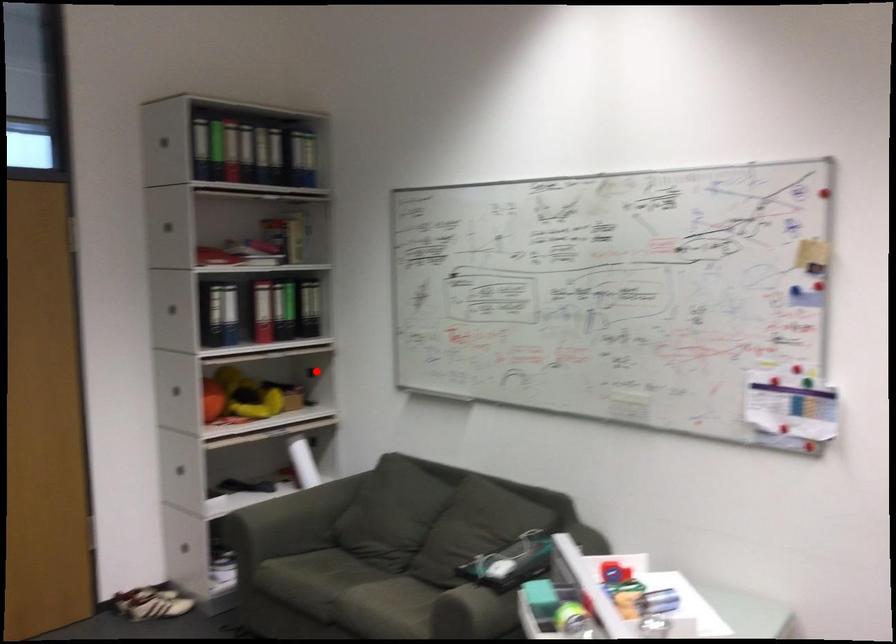
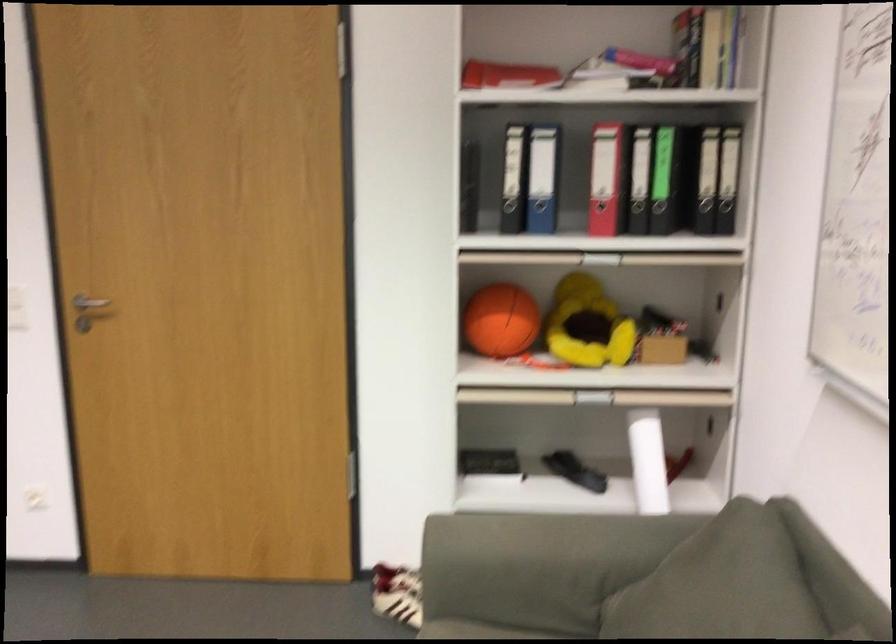
Where in the second image is the point corresponding to the highlighted location from the first image?

(725, 283)